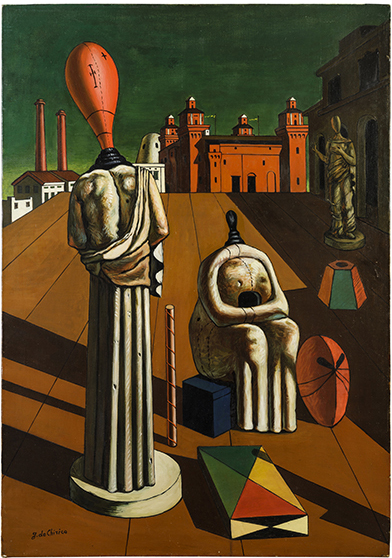
Image resolution: width=392 pixels, height=558 pixels. I want to click on statue, so click(x=345, y=167).